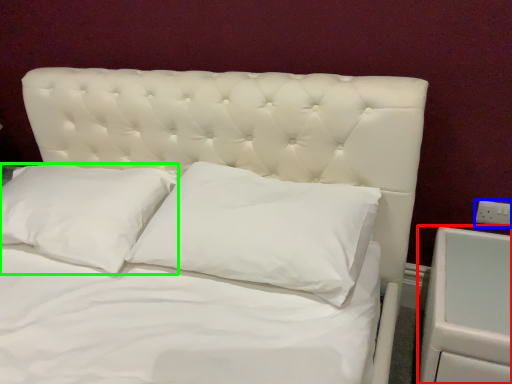
Question: Which object is positioned farthest from dresser (highlighted by a red box)? Select from electric outlet (highlighted by a blue box) and pillow (highlighted by a green box).

Choices:
 (A) electric outlet
 (B) pillow

Answer: (B)